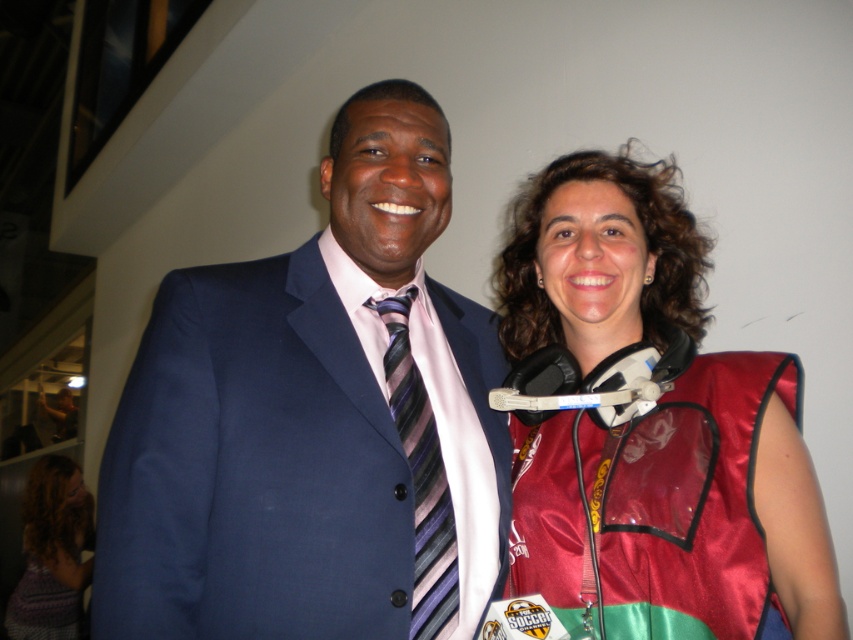
Question: Which of the following is the farthest from the observer?

Choices:
 (A) (413, 170)
 (B) (442, 627)
 (C) (616, 499)

Answer: (A)

Question: Which point is farther to the camera?

Choices:
 (A) striped silk tie at center
 (B) matte blue suit at center

Answer: (A)

Question: Does satin red vest at right have a lesser width compared to knitted purple sweater at lower left?

Choices:
 (A) no
 (B) yes

Answer: (B)

Question: Does striped silk tie at center have a lesser width compared to knitted purple sweater at lower left?

Choices:
 (A) no
 (B) yes

Answer: (B)

Question: Which of the following is the closest to the observer?

Choices:
 (A) (67, 522)
 (B) (374, 220)
 (C) (397, 298)
 (D) (685, 378)

Answer: (B)

Question: Observing the image, what is the correct spatial positioning of striped silk tie at center in reference to knitted purple sweater at lower left?

Choices:
 (A) left
 (B) right

Answer: (B)